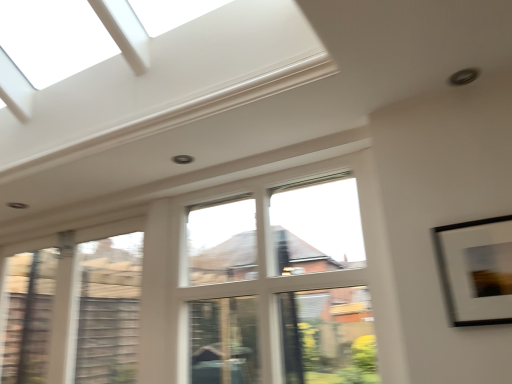
Question: Is clear glass window at center, acting as the 1th window starting from the right, turned away from white matte picture frame at upper right?

Choices:
 (A) yes
 (B) no

Answer: (B)

Question: From a real-world perspective, is clear glass window at center, acting as the 1th window starting from the right, physically above white matte picture frame at upper right?

Choices:
 (A) no
 (B) yes

Answer: (B)

Question: Can we say clear glass window at center, the second window positioned from the left, lies outside white matte picture frame at upper right?

Choices:
 (A) yes
 (B) no

Answer: (A)

Question: From the image's perspective, does clear glass window at center, acting as the 1th window starting from the right, appear lower than white matte picture frame at upper right?

Choices:
 (A) yes
 (B) no

Answer: (A)

Question: Is clear glass window at center, acting as the 1th window starting from the right, thinner than white matte picture frame at upper right?

Choices:
 (A) yes
 (B) no

Answer: (B)

Question: From a real-world perspective, is clear glass window at center, the second window positioned from the left, under white matte picture frame at upper right?

Choices:
 (A) yes
 (B) no

Answer: (B)

Question: Is there a large distance between clear glass window at center, acting as the 1th window starting from the right, and clear glass window at left, positioned as the 1th window in left-to-right order?

Choices:
 (A) no
 (B) yes

Answer: (A)

Question: Considering the relative sizes of clear glass window at center, the second window positioned from the left, and clear glass window at left, placed as the second window when sorted from right to left, in the image provided, is clear glass window at center, the second window positioned from the left, smaller than clear glass window at left, placed as the second window when sorted from right to left,?

Choices:
 (A) yes
 (B) no

Answer: (B)

Question: From the image's perspective, is clear glass window at center, the second window positioned from the left, over clear glass window at left, placed as the second window when sorted from right to left?

Choices:
 (A) yes
 (B) no

Answer: (A)

Question: Is clear glass window at center, the second window positioned from the left, at the left side of clear glass window at left, positioned as the 1th window in left-to-right order?

Choices:
 (A) yes
 (B) no

Answer: (B)

Question: Is clear glass window at center, acting as the 1th window starting from the right, further to camera compared to clear glass window at left, positioned as the 1th window in left-to-right order?

Choices:
 (A) yes
 (B) no

Answer: (B)

Question: Is clear glass window at left, placed as the second window when sorted from right to left, completely or partially inside clear glass window at center, the second window positioned from the left?

Choices:
 (A) no
 (B) yes

Answer: (A)

Question: From the image's perspective, is white matte picture frame at upper right on top of clear glass window at left, placed as the second window when sorted from right to left?

Choices:
 (A) yes
 (B) no

Answer: (A)